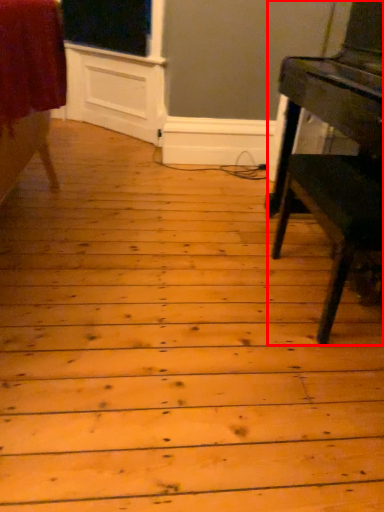
Question: From the image's perspective, considering the relative positions of table (annotated by the red box) and furniture in the image provided, where is table (annotated by the red box) located with respect to the staircase?

Choices:
 (A) below
 (B) above

Answer: (A)